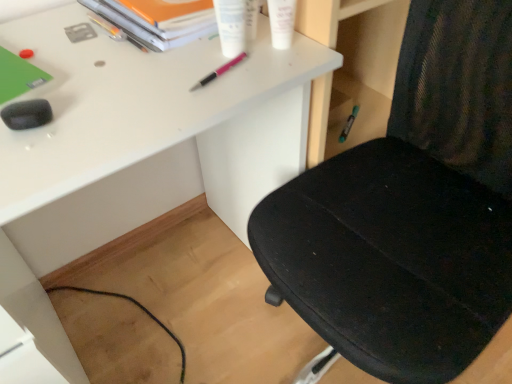
Image resolution: width=512 pixels, height=384 pixels. What are the coordinates of `vacant space situated on the left part of pink metallic pen at upper center, the third stationery positioned from the left` in the screenshot? It's located at (115, 78).